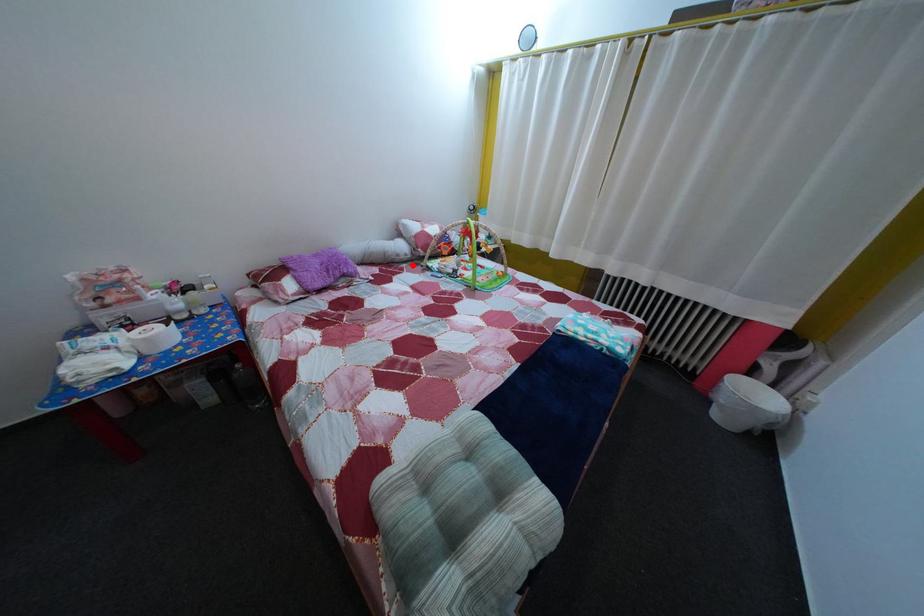
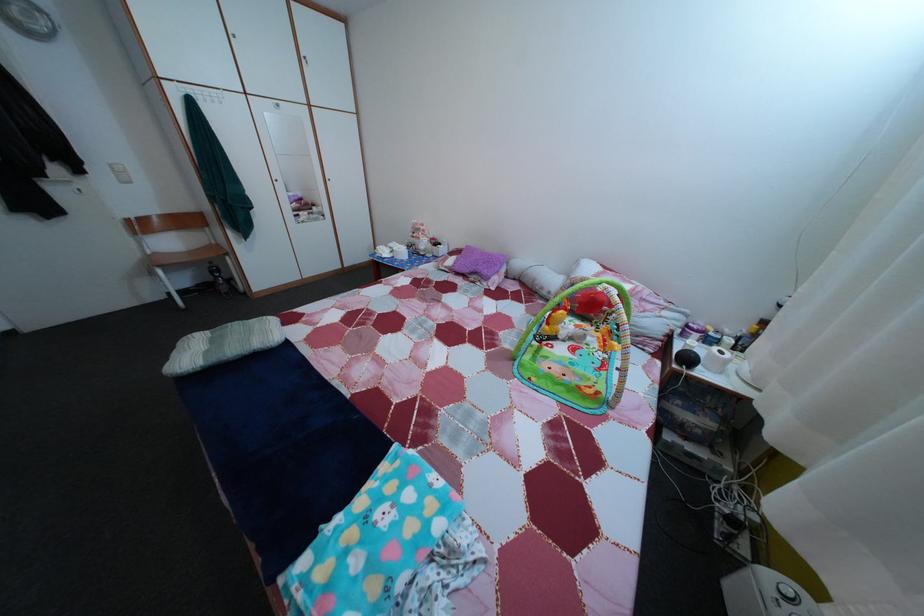
Where in the second image is the point corresponding to the highlighted location from the first image?

(553, 301)